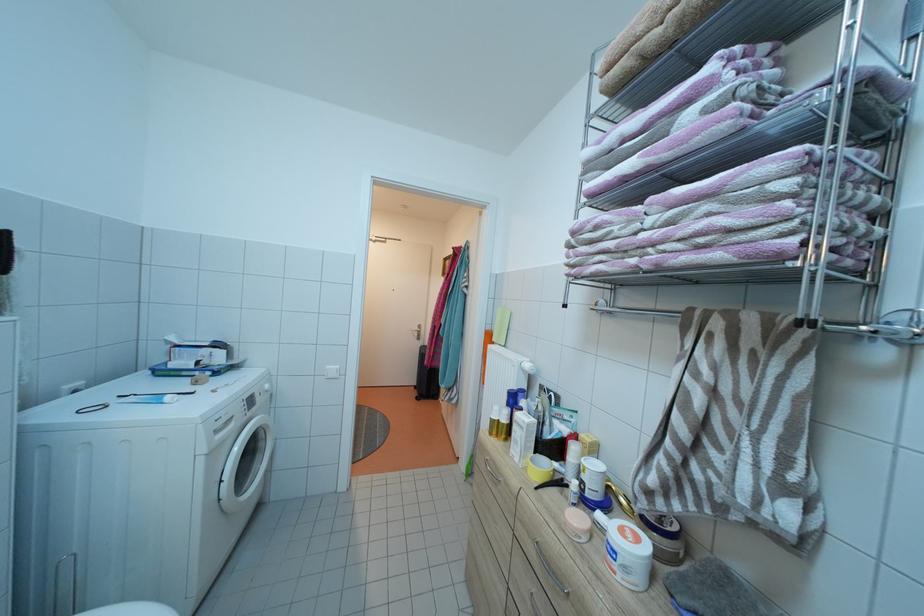
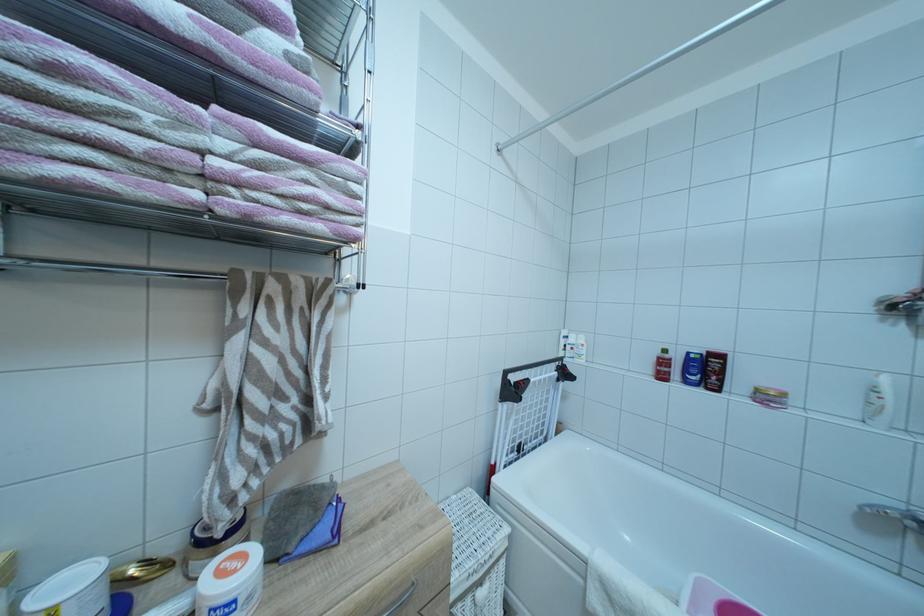
Question: The first image is from the beginning of the video and the second image is from the end. How did the camera likely rotate when shooting the video?

Choices:
 (A) Left
 (B) Right
 (C) Up
 (D) Down

Answer: (B)